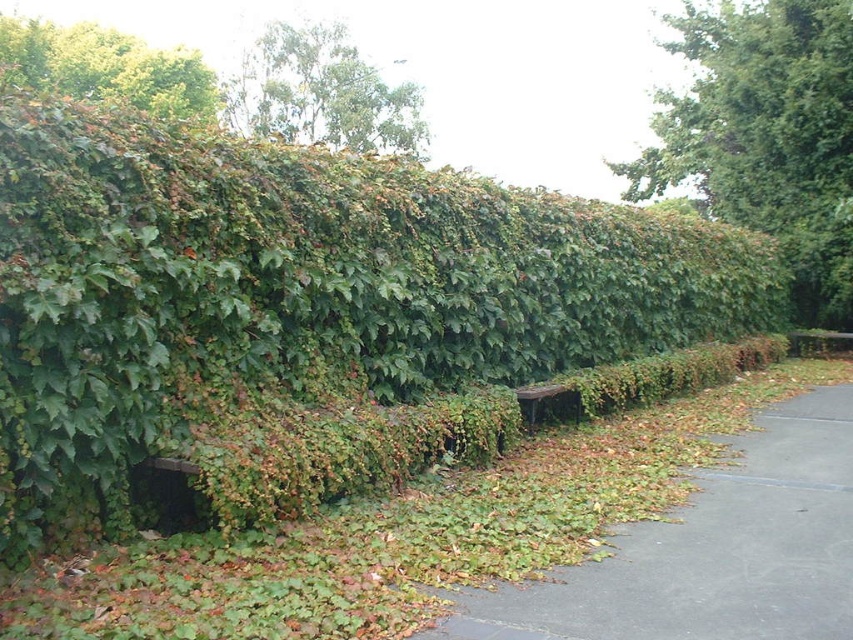
Question: Does green leafy hedge at center have a greater width compared to gray asphalt pavement at lower right?

Choices:
 (A) yes
 (B) no

Answer: (A)

Question: Which point is closer to the camera?

Choices:
 (A) (51, 259)
 (B) (64, 42)

Answer: (A)

Question: Is green leafy tree at upper center thinner than wooden park bench at center?

Choices:
 (A) yes
 (B) no

Answer: (B)

Question: Is gray asphalt pavement at lower right to the left of green leafy tree at upper left from the viewer's perspective?

Choices:
 (A) yes
 (B) no

Answer: (B)

Question: Which object appears farthest from the camera in this image?

Choices:
 (A) green leafy hedge at upper center
 (B) gray asphalt pavement at lower right
 (C) wooden park bench at center
 (D) green leafy tree at upper left

Answer: (D)

Question: Estimate the real-world distances between objects in this image. Which object is farther from the green leafy tree at upper left?

Choices:
 (A) green leafy hedge at center
 (B) wooden park bench at center
 (C) green leafy hedge at upper center
 (D) green leafy tree at upper center

Answer: (B)